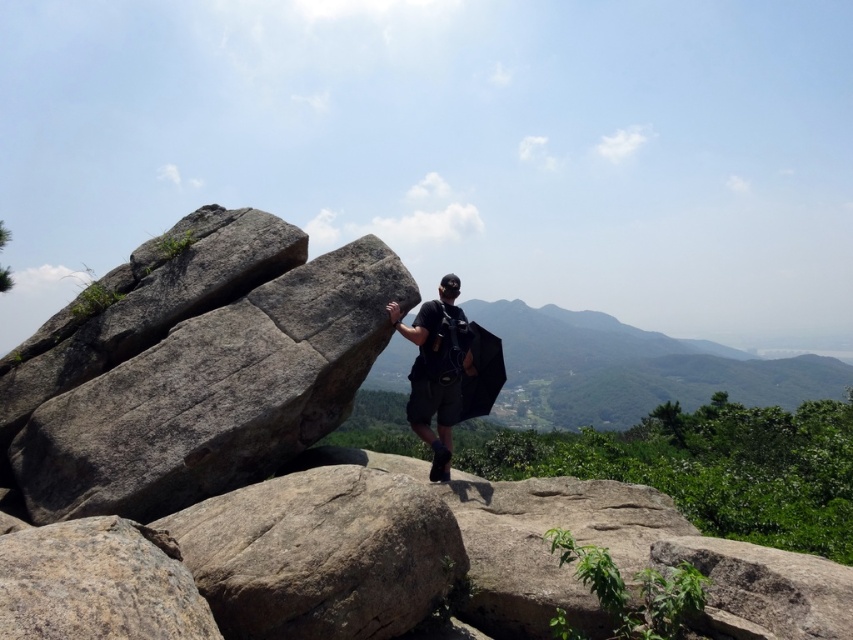
Question: Which object is farther from the camera taking this photo?

Choices:
 (A) gray rough rock at left
 (B) gray rough boulder at lower left

Answer: (A)

Question: Can you confirm if gray rough rock at left is smaller than gray rough boulder at center?

Choices:
 (A) no
 (B) yes

Answer: (A)

Question: In this image, where is gray rough rock at left located relative to black matte backpack at center?

Choices:
 (A) left
 (B) right

Answer: (A)

Question: Which point is farther from the camera taking this photo?

Choices:
 (A) (202, 577)
 (B) (186, 620)
 (C) (56, 515)

Answer: (C)

Question: Which object is farther from the camera taking this photo?

Choices:
 (A) black matte backpack at center
 (B) gray rough boulder at center
 (C) gray rough rock at left
 (D) gray rough boulder at lower left

Answer: (A)

Question: Can you confirm if gray rough boulder at center is positioned below gray rough boulder at lower left?

Choices:
 (A) no
 (B) yes

Answer: (B)